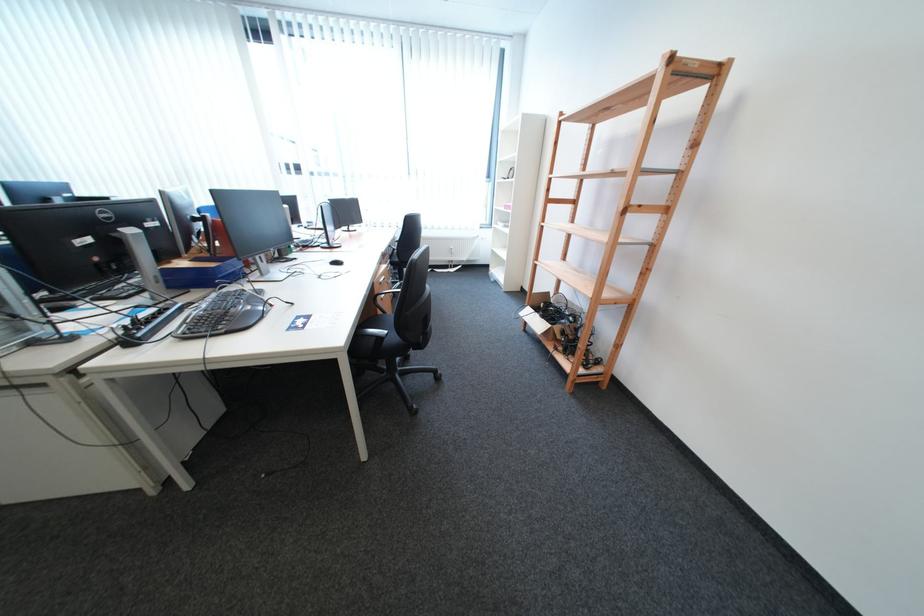
What are the coordinates of `blue plastic tray` in the screenshot? It's located at click(x=201, y=273).